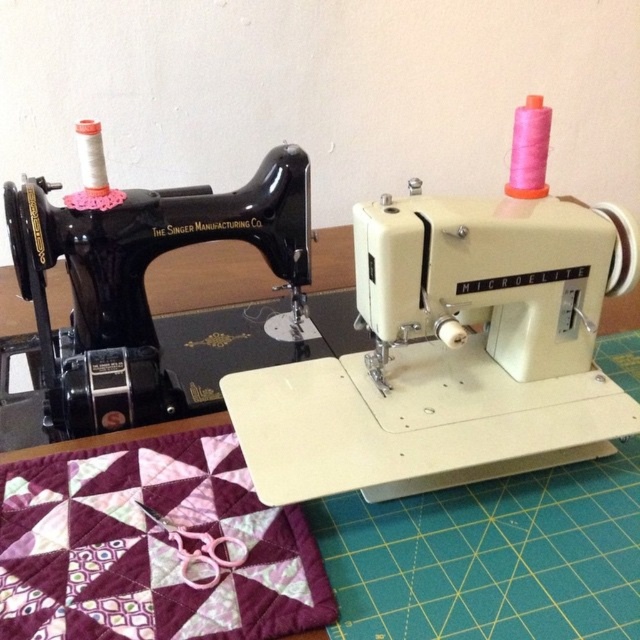
Who is shorter, white plastic sewing machine at center or black glossy singer manufacturing co sewing machine at left?

black glossy singer manufacturing co sewing machine at left is shorter.

Can you confirm if white plastic sewing machine at center is positioned below black glossy singer manufacturing co sewing machine at left?

Indeed, white plastic sewing machine at center is positioned under black glossy singer manufacturing co sewing machine at left.

Is point (524, 204) farther from camera compared to point (76, 202)?

No.

Locate an element on the screen. white plastic sewing machine at center is located at coordinates (452, 346).